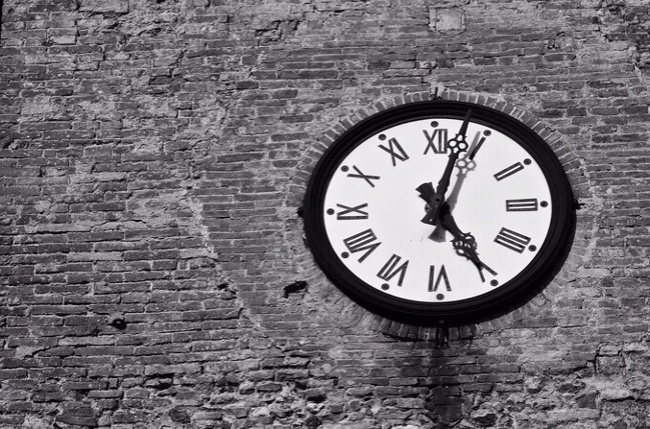
Find the location of a particular element. The image size is (650, 429). face of clock is located at coordinates (385, 197).